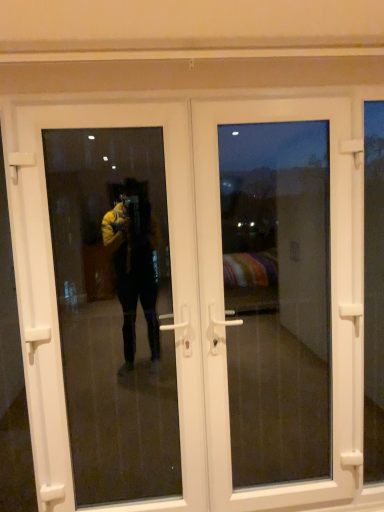
Consider the image. What is the approximate width of white plastic door at center, positioned as the first door in left-to-right order?

The width of white plastic door at center, positioned as the first door in left-to-right order, is 4.75 centimeters.

The width and height of the screenshot is (384, 512). Identify the location of white plastic door at center, which ranks as the 1th door in right-to-left order. [x=331, y=298].

Would you consider white plastic door at center, which ranks as the 1th door in right-to-left order, to be distant from white plastic door at center, positioned as the 2th door in right-to-left order?

They are positioned close to each other.

Is white plastic door at center, which ranks as the second door in left-to-right order, in front of or behind white plastic door at center, positioned as the 2th door in right-to-left order, in the image?

white plastic door at center, which ranks as the second door in left-to-right order, is positioned farther from the viewer than white plastic door at center, positioned as the 2th door in right-to-left order.

Is white plastic door at center, which ranks as the 1th door in right-to-left order, facing towards white plastic door at center, positioned as the first door in left-to-right order?

No, white plastic door at center, which ranks as the 1th door in right-to-left order, does not turn towards white plastic door at center, positioned as the first door in left-to-right order.

Can we say white plastic door at center, which ranks as the second door in left-to-right order, lies outside white plastic door at center, positioned as the first door in left-to-right order?

That's incorrect, white plastic door at center, which ranks as the second door in left-to-right order, is not completely outside white plastic door at center, positioned as the first door in left-to-right order.

Consider the image. Is transparent glass door at left bigger or smaller than white plastic door at center, which ranks as the 1th door in right-to-left order?

Considering their sizes, transparent glass door at left takes up less space than white plastic door at center, which ranks as the 1th door in right-to-left order.

Is transparent glass door at left next to white plastic door at center, which ranks as the 1th door in right-to-left order?

No, transparent glass door at left is not touching white plastic door at center, which ranks as the 1th door in right-to-left order.

Is transparent glass door at left oriented towards white plastic door at center, which ranks as the second door in left-to-right order?

No, transparent glass door at left does not turn towards white plastic door at center, which ranks as the second door in left-to-right order.

Is white plastic door at center, positioned as the 2th door in right-to-left order, looking in the opposite direction of white plastic door at center, which ranks as the second door in left-to-right order?

Yes, white plastic door at center, which ranks as the second door in left-to-right order, is at the back of white plastic door at center, positioned as the 2th door in right-to-left order.

Where is `door on the left of white plastic door at center, which ranks as the second door in left-to-right order`? door on the left of white plastic door at center, which ranks as the second door in left-to-right order is located at coordinates (188, 296).

Who is smaller, white plastic door at center, positioned as the 2th door in right-to-left order, or white plastic door at center, which ranks as the 1th door in right-to-left order?

white plastic door at center, which ranks as the 1th door in right-to-left order.

Is white plastic door at center, positioned as the 2th door in right-to-left order, further to the viewer compared to white plastic door at center, which ranks as the second door in left-to-right order?

No, the depth of white plastic door at center, positioned as the 2th door in right-to-left order, is less than that of white plastic door at center, which ranks as the second door in left-to-right order.

Would you say white plastic door at center, positioned as the first door in left-to-right order, is to the left or to the right of transparent glass door at left in the picture?

From the image, it's evident that white plastic door at center, positioned as the first door in left-to-right order, is to the right of transparent glass door at left.

Which of these two, white plastic door at center, positioned as the first door in left-to-right order, or transparent glass door at left, is smaller?

With smaller size is transparent glass door at left.

The width and height of the screenshot is (384, 512). Find the location of `the 1st door counting from the right of the transparent glass door at left`. the 1st door counting from the right of the transparent glass door at left is located at coordinates (188, 296).

Does white plastic door at center, positioned as the 2th door in right-to-left order, come in front of transparent glass door at left?

No, it is behind transparent glass door at left.

Locate an element on the screen. window screen that appears on the left of white plastic door at center, which ranks as the 1th door in right-to-left order is located at coordinates [x=114, y=310].

Can you confirm if white plastic door at center, which ranks as the 1th door in right-to-left order, is positioned to the right of transparent glass door at left?

Yes, white plastic door at center, which ranks as the 1th door in right-to-left order, is to the right of transparent glass door at left.

Considering the sizes of objects white plastic door at center, which ranks as the 1th door in right-to-left order, and transparent glass door at left in the image provided, who is bigger, white plastic door at center, which ranks as the 1th door in right-to-left order, or transparent glass door at left?

With larger size is white plastic door at center, which ranks as the 1th door in right-to-left order.

In the scene shown: Between transparent glass door at left and white plastic door at center, positioned as the 2th door in right-to-left order, which one is positioned behind?

Positioned behind is white plastic door at center, positioned as the 2th door in right-to-left order.

From the image's perspective, which one is positioned lower, transparent glass door at left or white plastic door at center, positioned as the first door in left-to-right order?

From the image's view, white plastic door at center, positioned as the first door in left-to-right order, is below.

Locate an element on the screen. The height and width of the screenshot is (512, 384). door above the white plastic door at center, positioned as the 2th door in right-to-left order (from the image's perspective) is located at coordinates (331, 298).

Locate an element on the screen. window screen that is on the left side of white plastic door at center, which ranks as the 1th door in right-to-left order is located at coordinates coord(114,310).

Which object lies further to the anchor point white plastic door at center, positioned as the 2th door in right-to-left order, transparent glass door at left or white plastic door at center, which ranks as the second door in left-to-right order?

transparent glass door at left.

Based on their spatial positions, is white plastic door at center, which ranks as the 1th door in right-to-left order, or transparent glass door at left closer to white plastic door at center, positioned as the 2th door in right-to-left order?

white plastic door at center, which ranks as the 1th door in right-to-left order.

From the image, which object appears to be farther from transparent glass door at left, white plastic door at center, positioned as the first door in left-to-right order, or white plastic door at center, which ranks as the second door in left-to-right order?

Based on the image, white plastic door at center, which ranks as the second door in left-to-right order, appears to be further to transparent glass door at left.

Based on their spatial positions, is transparent glass door at left or white plastic door at center, positioned as the 2th door in right-to-left order, further from white plastic door at center, which ranks as the 1th door in right-to-left order?

Based on the image, transparent glass door at left appears to be further to white plastic door at center, which ranks as the 1th door in right-to-left order.

From the image, which object appears to be farther from white plastic door at center, which ranks as the 1th door in right-to-left order, white plastic door at center, positioned as the 2th door in right-to-left order, or transparent glass door at left?

transparent glass door at left lies further to white plastic door at center, which ranks as the 1th door in right-to-left order, than the other object.

Which object lies further to the anchor point transparent glass door at left, white plastic door at center, which ranks as the second door in left-to-right order, or white plastic door at center, positioned as the 2th door in right-to-left order?

white plastic door at center, which ranks as the second door in left-to-right order.

Find the location of a particular element. This screenshot has width=384, height=512. door between transparent glass door at left and white plastic door at center, which ranks as the 1th door in right-to-left order, in the horizontal direction is located at coordinates (188, 296).